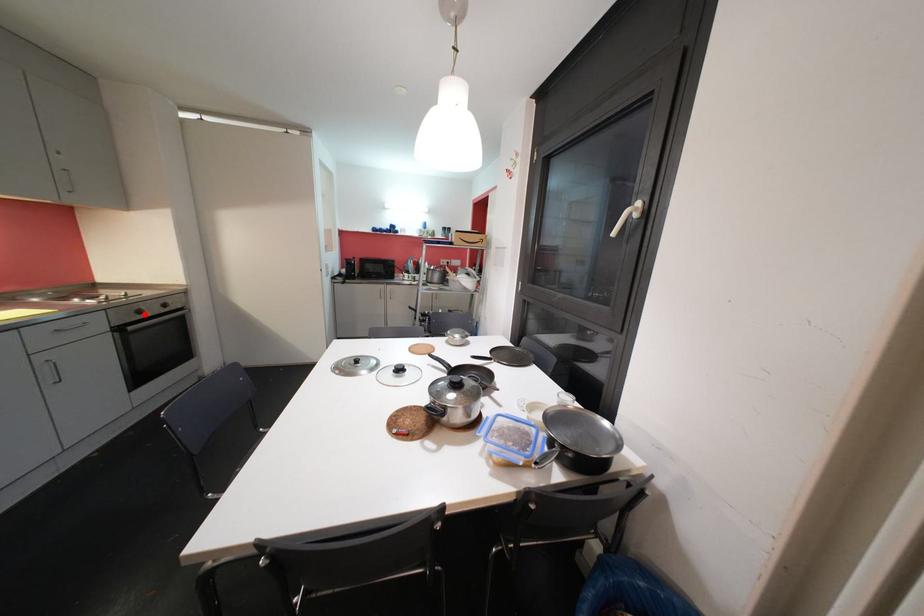
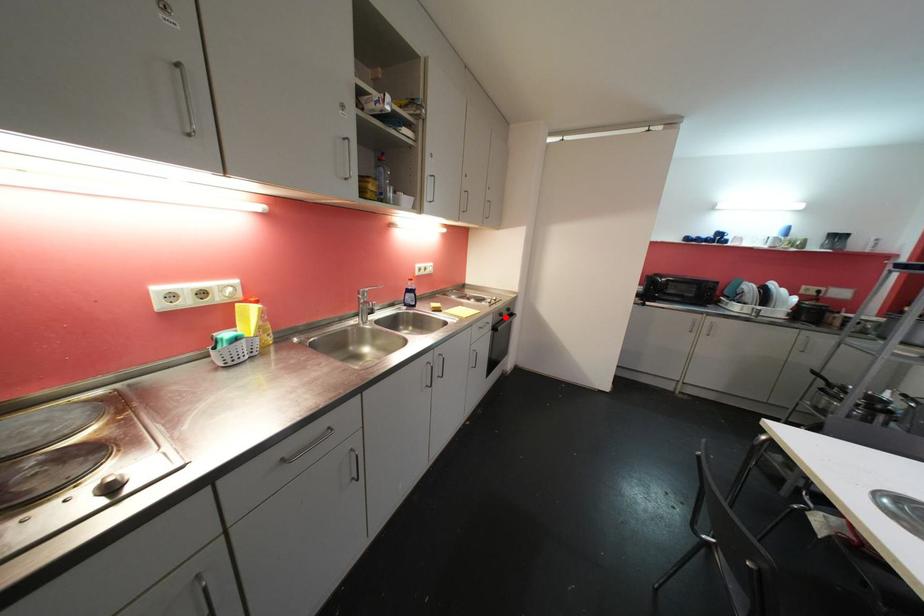
I am providing you with two images of the same scene from different viewpoints. A red point is marked on the first image and another point is marked on the second image. Do the highlighted points in image1 and image2 indicate the same real-world spot?

Yes